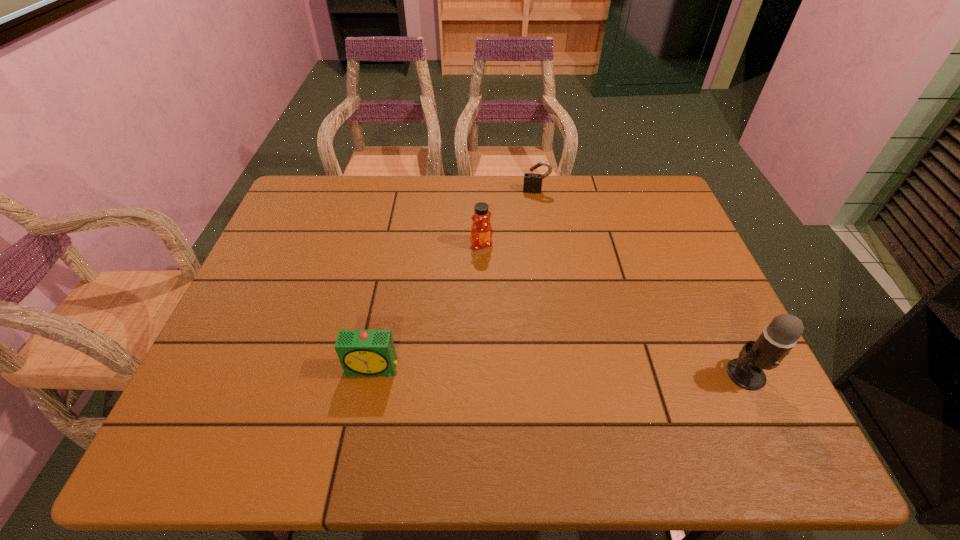
In the image, there is a desktop. At what (x,y) coordinates should I click in order to perform the action: click on vacant area at the near edge. Please return your answer as a coordinate pair (x, y). The image size is (960, 540). Looking at the image, I should click on (679, 394).

Find the location of a particular element. The height and width of the screenshot is (540, 960). free space at the left edge of the desktop is located at coordinates (281, 234).

Where is `blank space at the right edge of the desktop`? Image resolution: width=960 pixels, height=540 pixels. blank space at the right edge of the desktop is located at coordinates (724, 354).

The width and height of the screenshot is (960, 540). I want to click on blank space at the far left corner of the desktop, so click(x=301, y=187).

Where is `vacant space in between the second object from right to left and the leftmost object`? The image size is (960, 540). vacant space in between the second object from right to left and the leftmost object is located at coordinates (454, 280).

At what (x,y) coordinates should I click in order to perform the action: click on free point between the alarm clock and the padlock. Please return your answer as a coordinate pair (x, y). This screenshot has height=540, width=960. Looking at the image, I should click on (454, 280).

Locate an element on the screen. This screenshot has width=960, height=540. free space that is in between the leftmost object and the third shortest object is located at coordinates (427, 306).

Locate an element on the screen. The image size is (960, 540). free point between the alarm clock and the third nearest object is located at coordinates point(427,306).

Locate an element on the screen. vacant point located between the alarm clock and the third object from left to right is located at coordinates (454, 280).

Identify the location of free spot between the third object from right to left and the leftmost object. The image size is (960, 540). (427, 306).